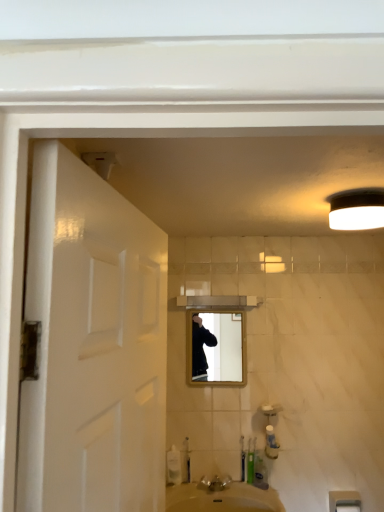
Question: Is green plastic toothbrush at lower center to the right of matte wooden mirror at center from the viewer's perspective?

Choices:
 (A) yes
 (B) no

Answer: (A)

Question: Is the position of green plastic toothbrush at lower center less distant than that of matte wooden mirror at center?

Choices:
 (A) no
 (B) yes

Answer: (B)

Question: From the image's perspective, is green plastic toothbrush at lower center on matte wooden mirror at center?

Choices:
 (A) yes
 (B) no

Answer: (B)

Question: Is green plastic toothbrush at lower center facing away from matte wooden mirror at center?

Choices:
 (A) no
 (B) yes

Answer: (A)

Question: Can we say green plastic toothbrush at lower center lies outside matte wooden mirror at center?

Choices:
 (A) yes
 (B) no

Answer: (A)

Question: From a real-world perspective, is green plastic toothbrush at lower center below matte wooden mirror at center?

Choices:
 (A) no
 (B) yes

Answer: (B)

Question: Is green plastic toothbrush at lower center far from white matte light fixture at upper right?

Choices:
 (A) yes
 (B) no

Answer: (A)

Question: Is green plastic toothbrush at lower center closer to the viewer compared to white matte light fixture at upper right?

Choices:
 (A) yes
 (B) no

Answer: (B)

Question: From a real-world perspective, is green plastic toothbrush at lower center positioned over white matte light fixture at upper right based on gravity?

Choices:
 (A) no
 (B) yes

Answer: (A)

Question: Can you confirm if green plastic toothbrush at lower center is bigger than white matte light fixture at upper right?

Choices:
 (A) yes
 (B) no

Answer: (B)

Question: Can you confirm if green plastic toothbrush at lower center is smaller than white matte light fixture at upper right?

Choices:
 (A) yes
 (B) no

Answer: (A)

Question: Is white matte light fixture at upper right at the back of green plastic toothbrush at lower center?

Choices:
 (A) no
 (B) yes

Answer: (A)

Question: Is white plastic towel bar at lower right aimed at green plastic toothbrush at lower center?

Choices:
 (A) no
 (B) yes

Answer: (A)